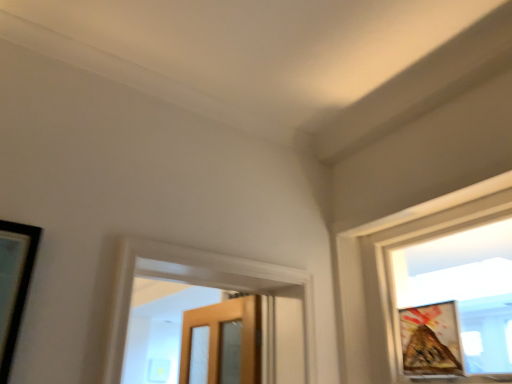
Question: From a real-world perspective, is wooden textured picture frame at right below matte glass window at upper right?

Choices:
 (A) yes
 (B) no

Answer: (A)

Question: Is wooden textured picture frame at right not near matte glass window at upper right?

Choices:
 (A) yes
 (B) no

Answer: (B)

Question: Does wooden textured picture frame at right have a lesser width compared to matte glass window at upper right?

Choices:
 (A) yes
 (B) no

Answer: (A)

Question: Is matte glass window at upper right at the back of wooden textured picture frame at right?

Choices:
 (A) yes
 (B) no

Answer: (A)

Question: Is wooden textured picture frame at right closer to the viewer compared to matte glass window at upper right?

Choices:
 (A) no
 (B) yes

Answer: (A)

Question: Is wooden textured picture frame at right wider than matte glass window at upper right?

Choices:
 (A) no
 (B) yes

Answer: (A)

Question: Can you confirm if matte glass window at upper right is thinner than wooden textured picture frame at right?

Choices:
 (A) yes
 (B) no

Answer: (B)

Question: Are matte glass window at upper right and wooden textured picture frame at right making contact?

Choices:
 (A) no
 (B) yes

Answer: (A)

Question: From the image's perspective, is matte glass window at upper right under wooden textured picture frame at right?

Choices:
 (A) no
 (B) yes

Answer: (A)

Question: From a real-world perspective, does matte glass window at upper right stand above wooden textured picture frame at right?

Choices:
 (A) no
 (B) yes

Answer: (B)

Question: Is matte glass window at upper right positioned with its back to wooden textured picture frame at right?

Choices:
 (A) no
 (B) yes

Answer: (B)

Question: Is matte glass window at upper right further to camera compared to wooden textured picture frame at right?

Choices:
 (A) no
 (B) yes

Answer: (A)

Question: In the image, is matte glass window at upper right on the left side or the right side of wooden textured picture frame at right?

Choices:
 (A) left
 (B) right

Answer: (B)